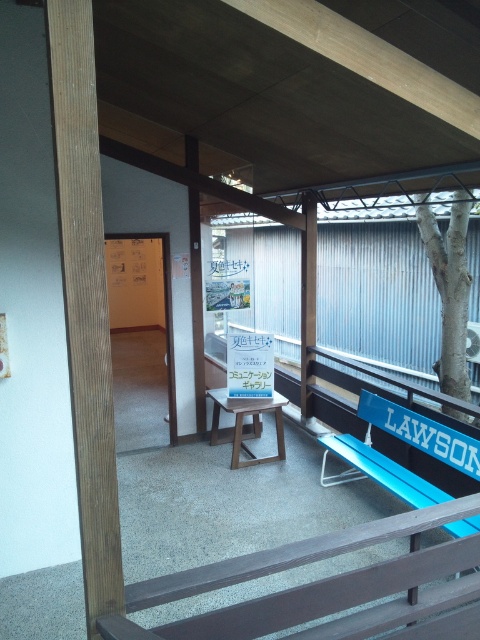
Is blue plastic bench at right wider than white textured tree at right?

Yes, blue plastic bench at right is wider than white textured tree at right.

Can you confirm if blue plastic bench at right is taller than white textured tree at right?

No.

The width and height of the screenshot is (480, 640). I want to click on blue plastic bench at right, so click(406, 442).

You are a GUI agent. You are given a task and a screenshot of the screen. Output one action in this format:
    pyautogui.click(x=<x>, y=<y>)
    Task: Click on the blue plastic bench at right
    This screenshot has height=640, width=480.
    Given the screenshot: What is the action you would take?
    pyautogui.click(x=406, y=442)

Who is more distant from viewer, (60, 80) or (456, 340)?

The point (456, 340) is behind.

I want to click on brown wood at left, so click(x=85, y=310).

Identify the location of brown wood at left. This screenshot has height=640, width=480. (85, 310).

Where is `brown wood at left`? This screenshot has width=480, height=640. brown wood at left is located at coordinates (85, 310).

This screenshot has width=480, height=640. Describe the element at coordinates (85, 310) in the screenshot. I see `brown wood at left` at that location.

The height and width of the screenshot is (640, 480). In order to click on brown wood at left in this screenshot , I will do `click(85, 310)`.